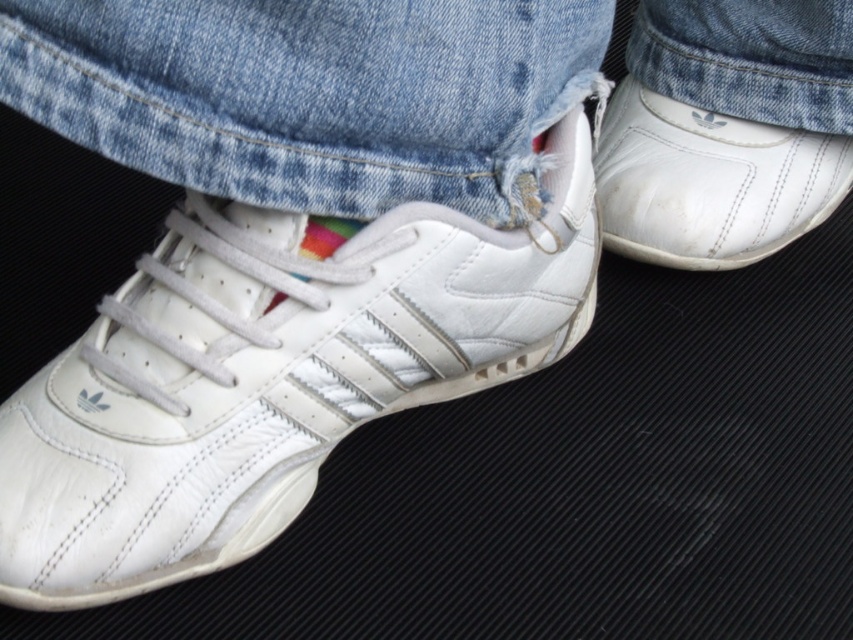
Question: Is white leather sneaker at lower left closer to the viewer compared to white leather shoe at right?

Choices:
 (A) no
 (B) yes

Answer: (B)

Question: Which object is the farthest from the denim at center?

Choices:
 (A) white leather sneaker at lower left
 (B) white leather shoe at right

Answer: (B)

Question: Does white leather sneaker at lower left appear on the right side of white leather shoe at right?

Choices:
 (A) yes
 (B) no

Answer: (B)

Question: Which object is the farthest from the denim at center?

Choices:
 (A) white leather shoe at right
 (B) white leather sneaker at lower left

Answer: (A)

Question: Which of the following is the closest to the observer?

Choices:
 (A) denim at center
 (B) white leather sneaker at lower left
 (C) white leather shoe at right

Answer: (A)

Question: Does denim at center appear on the right side of white leather shoe at right?

Choices:
 (A) yes
 (B) no

Answer: (B)